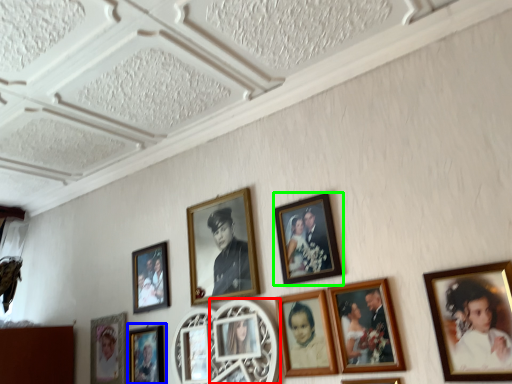
Question: Which object is the farthest from picture frame (highlighted by a red box)? Choose among these: picture frame (highlighted by a blue box) or picture frame (highlighted by a green box).

Choices:
 (A) picture frame
 (B) picture frame

Answer: (A)